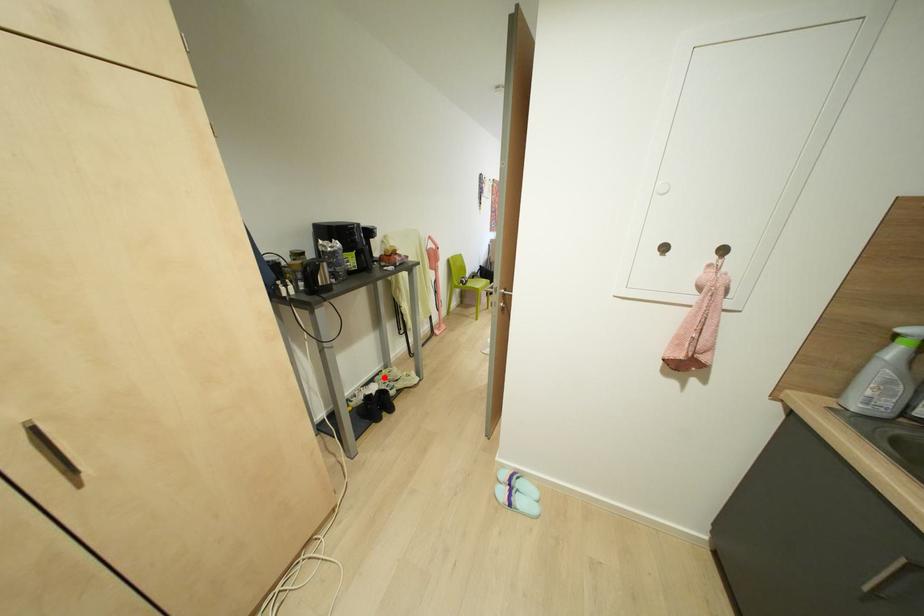
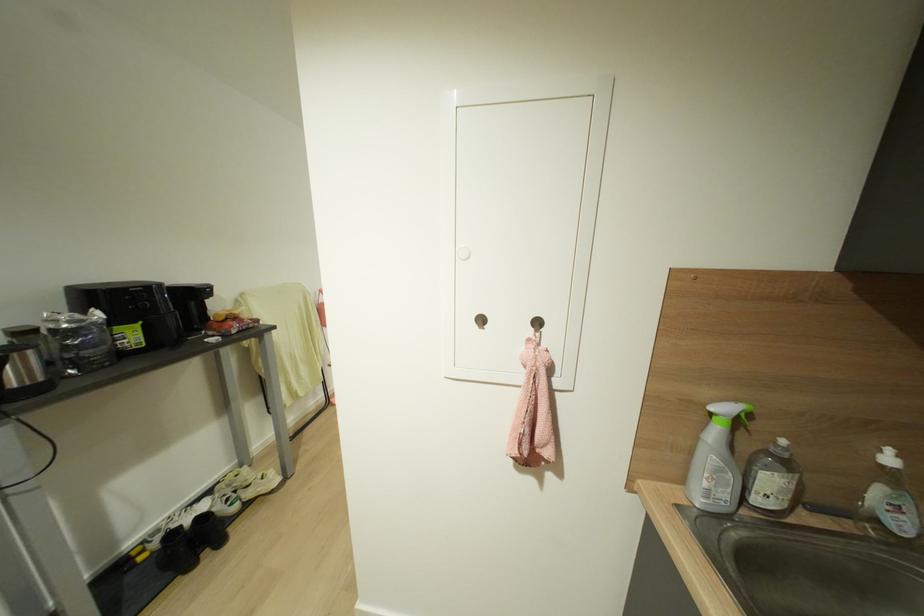
Find the pixel in the second image that matches the highlighted location in the first image.

(227, 485)